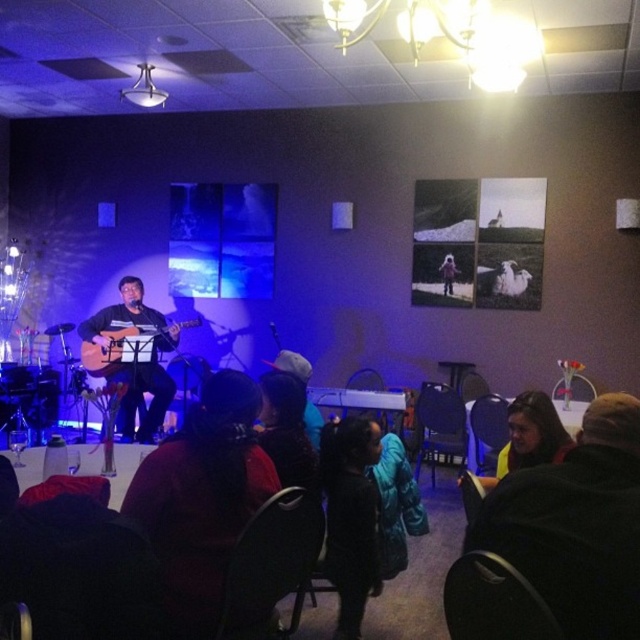
You are a photographer at the live music performance. You need to place a microphone stand exactly at the center of the stage. The stage is represented by the area where the performer is located. The performer is at point (138, 364). Is the microphone stand placed correctly if you put it at the center of the stage?

The point (138, 364) is where the matte black guitar at center is located. Since the performer is positioned on the left, the center of the stage would not align with the performer. Therefore, placing the microphone stand at the performer location would not be at the center of the stage.

You are a photographer standing at the entrance of the room. You want to take a photo of the matte black guitar at center. What are the coordinates of the guitar to frame it properly?

The coordinates of the matte black guitar at center are at point (138, 364).